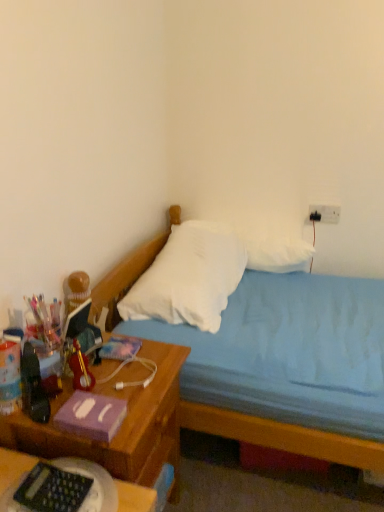
Question: Considering the positions of black plastic keyboard at lower left and blue fabric bed at center in the image, is black plastic keyboard at lower left bigger or smaller than blue fabric bed at center?

Choices:
 (A) small
 (B) big

Answer: (A)

Question: Does point (6, 462) appear closer or farther from the camera than point (251, 445)?

Choices:
 (A) farther
 (B) closer

Answer: (B)

Question: Estimate the real-world distances between objects in this image. Which object is closer to the woodennightstand at left?

Choices:
 (A) black plastic keyboard at lower left
 (B) white soft pillow at center, the 2th pillow viewed from the back
 (C) white plastic electric outlet at upper right
 (D) white soft pillow at upper center, arranged as the 1th pillow when viewed from the back
 (E) blue fabric bed at center

Answer: (A)

Question: Estimate the real-world distances between objects in this image. Which object is closer to the white plastic electric outlet at upper right?

Choices:
 (A) white soft pillow at center, the 1th pillow in the front-to-back sequence
 (B) blue fabric bed at center
 (C) white soft pillow at upper center, arranged as the 1th pillow when viewed from the back
 (D) black plastic keyboard at lower left
 (E) woodennightstand at left

Answer: (C)